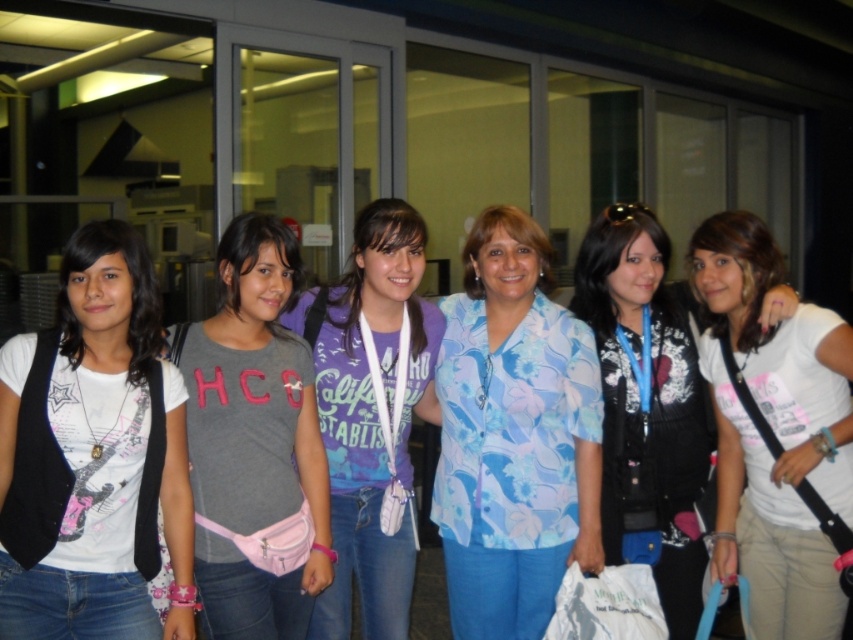
Which of these two, black matte vest at left or white cotton shirt at center, stands shorter?

With less height is black matte vest at left.

Between point (134, 544) and point (775, 518), which one is positioned in front?

Positioned in front is point (134, 544).

Describe the element at coordinates (106, 448) in the screenshot. I see `black matte vest at left` at that location.

You are a GUI agent. You are given a task and a screenshot of the screen. Output one action in this format:
    pyautogui.click(x=<x>, y=<y>)
    Task: Click on the black matte vest at left
    
    Given the screenshot: What is the action you would take?
    pyautogui.click(x=106, y=448)

Between point (573, 452) and point (238, 460), which one is positioned behind?

The point (573, 452) is more distant.

From the picture: Which of these two, floral-patterned blouse at center or gray fabric shirt at center, stands shorter?

gray fabric shirt at center

Identify the location of floral-patterned blouse at center. (514, 435).

Locate an element on the screen. This screenshot has height=640, width=853. floral-patterned blouse at center is located at coordinates (514, 435).

Can you confirm if gray fabric shirt at center is positioned to the left of white cotton shirt at center?

A: Correct, you'll find gray fabric shirt at center to the left of white cotton shirt at center.

Which is in front, point (231, 317) or point (694, 240)?

Point (231, 317) is more forward.

In order to click on gray fabric shirt at center in this screenshot , I will do `click(254, 442)`.

Find the location of `gray fabric shirt at center`. gray fabric shirt at center is located at coordinates (254, 442).